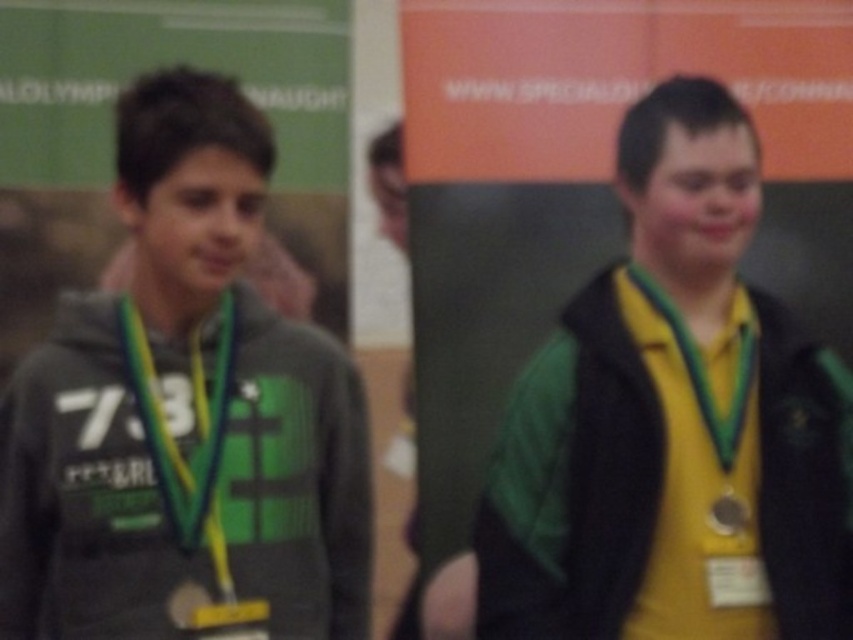
Question: Which of these objects is positioned farthest from the black matte vest at right?

Choices:
 (A) green fabric neck at center
 (B) yellow-green lanyard at right
 (C) metallic silver medal at right

Answer: (A)

Question: Among these points, which one is farthest from the camera?

Choices:
 (A) (161, 317)
 (B) (732, 508)

Answer: (A)

Question: Which of the following is the closest to the observer?

Choices:
 (A) (762, 490)
 (B) (190, 246)
 (C) (192, 458)

Answer: (B)

Question: Does yellow-green lanyard at right have a smaller size compared to metallic silver medal at right?

Choices:
 (A) no
 (B) yes

Answer: (A)

Question: Can you confirm if matte green hoodie at left is wider than green fabric neck at center?

Choices:
 (A) yes
 (B) no

Answer: (A)

Question: Does matte green hoodie at left have a larger size compared to yellow-green lanyard at right?

Choices:
 (A) no
 (B) yes

Answer: (B)